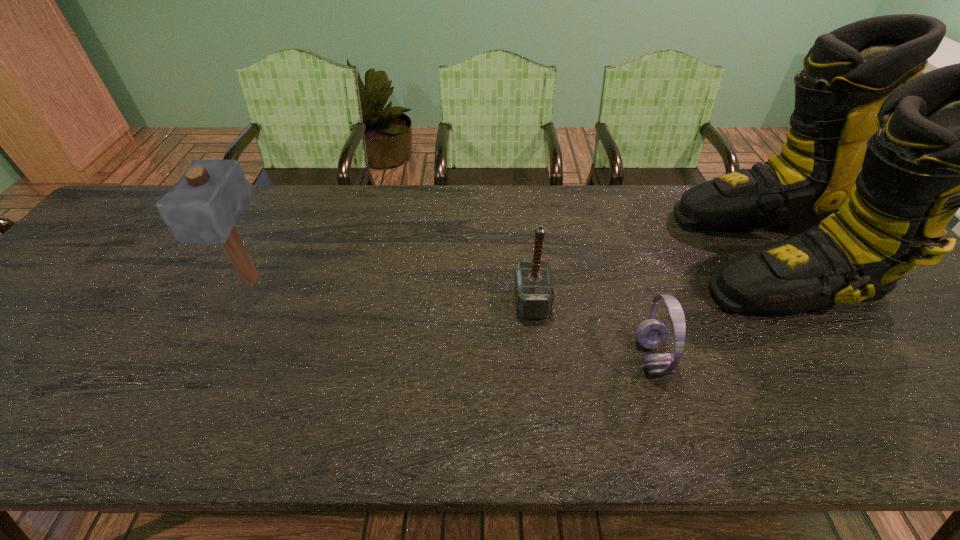
Where is `vacant space located on the right of the hammer`? vacant space located on the right of the hammer is located at coordinates (576, 302).

Find the location of a particular element. vacant space located 0.380m on the headband and ear cups of the headset is located at coordinates (466, 357).

Find the location of a particular element. vacant space located 0.320m on the headband and ear cups of the headset is located at coordinates (492, 357).

The height and width of the screenshot is (540, 960). Identify the location of vacant space located 0.370m on the headband and ear cups of the headset. (470, 357).

Locate an element on the screen. Image resolution: width=960 pixels, height=540 pixels. object that is at the far edge is located at coordinates (878, 159).

This screenshot has height=540, width=960. I want to click on object that is at the right edge, so click(x=878, y=159).

The height and width of the screenshot is (540, 960). Identify the location of object at the far right corner. (878, 159).

This screenshot has width=960, height=540. I want to click on vacant space at the far edge of the desktop, so click(396, 226).

The width and height of the screenshot is (960, 540). I want to click on free location at the near edge, so click(52, 444).

In the image, there is a desktop. Identify the location of blank space at the right edge. (887, 295).